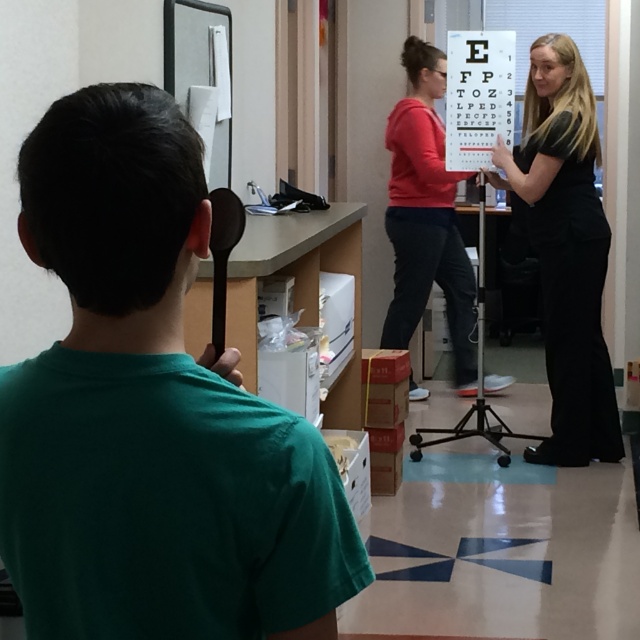
Question: Does green matte shirt at center appear on the left side of matte red shirt at center?

Choices:
 (A) yes
 (B) no

Answer: (A)

Question: Which point appears farthest from the camera in this image?

Choices:
 (A) (445, 292)
 (B) (20, 432)

Answer: (A)

Question: Can you confirm if black smooth dress at right is positioned above matte red shirt at center?

Choices:
 (A) yes
 (B) no

Answer: (B)

Question: Can you confirm if black smooth dress at right is positioned to the left of matte red shirt at center?

Choices:
 (A) no
 (B) yes

Answer: (A)

Question: Which object is positioned farthest from the black smooth dress at right?

Choices:
 (A) green matte shirt at center
 (B) matte red shirt at center

Answer: (A)

Question: Which point is closer to the camera taking this photo?

Choices:
 (A) (189, 500)
 (B) (570, 360)
 (C) (454, 244)

Answer: (A)